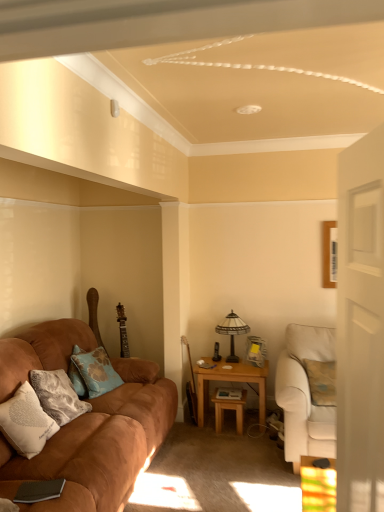
Question: From their relative heights in the image, would you say suede brown couch at left, the second studio couch from the right, is taller or shorter than white glossy door at right?

Choices:
 (A) tall
 (B) short

Answer: (B)

Question: Is suede brown couch at left, arranged as the first studio couch when viewed from the left, inside or outside of white glossy door at right?

Choices:
 (A) inside
 (B) outside

Answer: (B)

Question: Which object is the farthest from the blue fabric pillow at left, the 1th pillow positioned from the back?

Choices:
 (A) wooden table at center, acting as the 2th table starting from the right
 (B) light brown wooden table at center right, which is counted as the 1th table, starting from the right
 (C) white glossy door at right
 (D) white soft pillow at lower left, the 2th pillow from the back
 (E) suede brown couch at left, the second studio couch from the right

Answer: (C)

Question: Which of these objects is positioned closest to the beige fabric armchair at right, marked as the second studio couch in a left-to-right arrangement?

Choices:
 (A) light brown wooden table at center right, which is counted as the 1th table, starting from the right
 (B) wooden table at center, acting as the 2th table starting from the right
 (C) white soft pillow at lower left, arranged as the first pillow when viewed from the front
 (D) stained glass lampshade at center-right
 (E) white glossy door at right

Answer: (A)